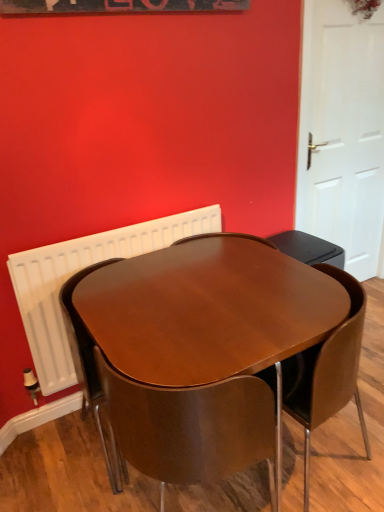
The width and height of the screenshot is (384, 512). I want to click on vacant area on top of glossy wood table at center (from a real-world perspective), so pos(212,287).